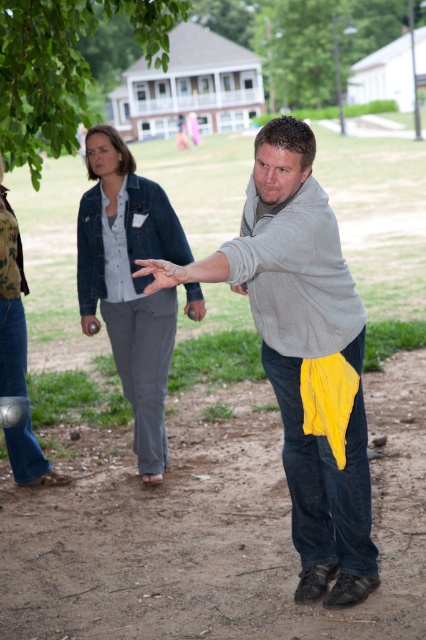
Does denim jacket at upper left have a smaller size compared to denim pants at center?

No, denim jacket at upper left is not smaller than denim pants at center.

Does denim jacket at upper left appear under denim pants at center?

No.

Is point (164, 300) closer to viewer compared to point (5, 225)?

No, (164, 300) is further to viewer.

Locate an element on the screen. The image size is (426, 640). denim jacket at upper left is located at coordinates (129, 284).

Does green leafy tree at upper left appear on the right side of denim jacket at upper center?

Incorrect, green leafy tree at upper left is not on the right side of denim jacket at upper center.

Does green leafy tree at upper left lie behind denim jacket at upper center?

Yes, green leafy tree at upper left is further from the viewer.

At what (x,y) coordinates should I click in order to perform the action: click on green leafy tree at upper left. Please return your answer as a coordinate pair (x, y). The height and width of the screenshot is (640, 426). Looking at the image, I should click on (63, 67).

This screenshot has height=640, width=426. I want to click on green leafy tree at upper left, so click(63, 67).

Can you confirm if green leafy tree at upper left is wider than gray fleece sweatshirt at center?

Correct, the width of green leafy tree at upper left exceeds that of gray fleece sweatshirt at center.

Is point (68, 13) farther from camera compared to point (325, 339)?

Yes, point (68, 13) is farther from viewer.

Identify the location of green leafy tree at upper left. This screenshot has width=426, height=640. (63, 67).